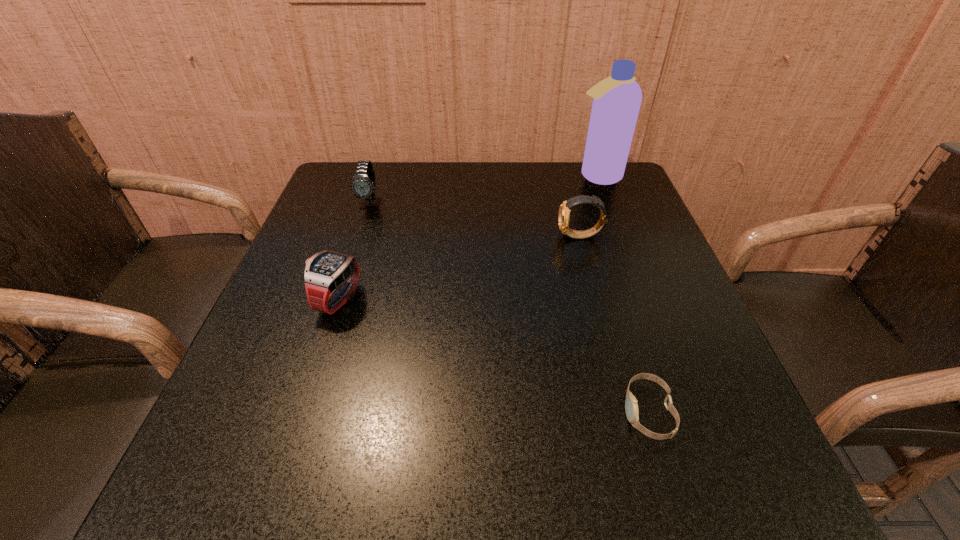
Locate an element on the screen. The image size is (960, 540). free spot between the farthest watch and the nearest object is located at coordinates (510, 308).

At what (x,y) coordinates should I click in order to perform the action: click on free spot between the second nearest watch and the nearest object. Please return your answer as a coordinate pair (x, y). This screenshot has height=540, width=960. Looking at the image, I should click on (492, 356).

The height and width of the screenshot is (540, 960). What are the coordinates of `vacant area between the third farthest object and the second nearest watch` in the screenshot? It's located at (459, 268).

Find the location of a particular element. vacant region between the second nearest watch and the shortest object is located at coordinates (492, 356).

Identify the location of free area in between the farthest watch and the second farthest watch. Image resolution: width=960 pixels, height=540 pixels. (475, 220).

I want to click on free space between the farthest watch and the third farthest watch, so click(x=354, y=252).

I want to click on free space between the second farthest watch and the second nearest watch, so click(459, 268).

The height and width of the screenshot is (540, 960). What are the coordinates of `unoccupied position between the second farthest object and the shortest object` in the screenshot? It's located at (510, 308).

Where is `object identified as the third closest to the second nearest watch`? This screenshot has width=960, height=540. object identified as the third closest to the second nearest watch is located at coordinates (631, 406).

Locate an element on the screen. The width and height of the screenshot is (960, 540). the fourth closest object to the tallest object is located at coordinates (631, 406).